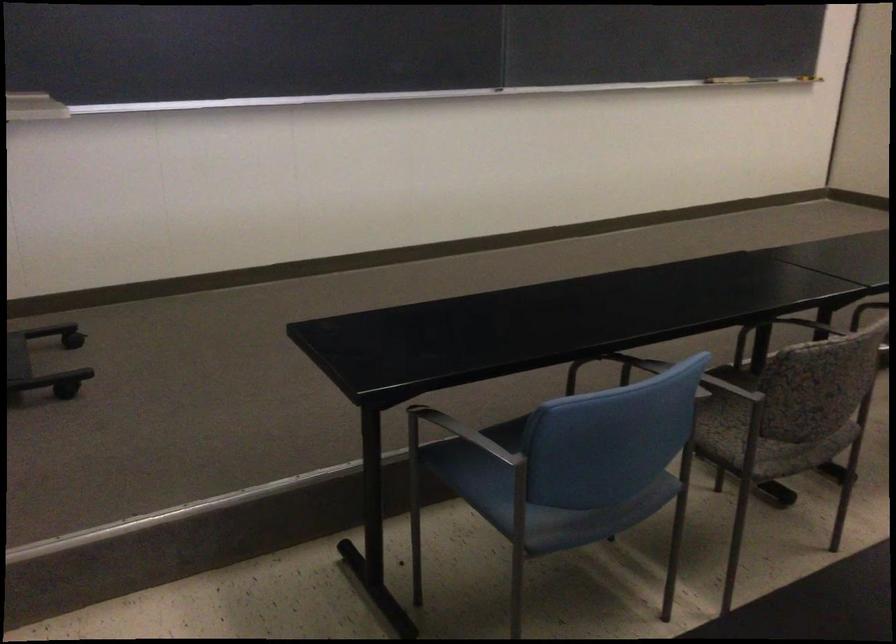
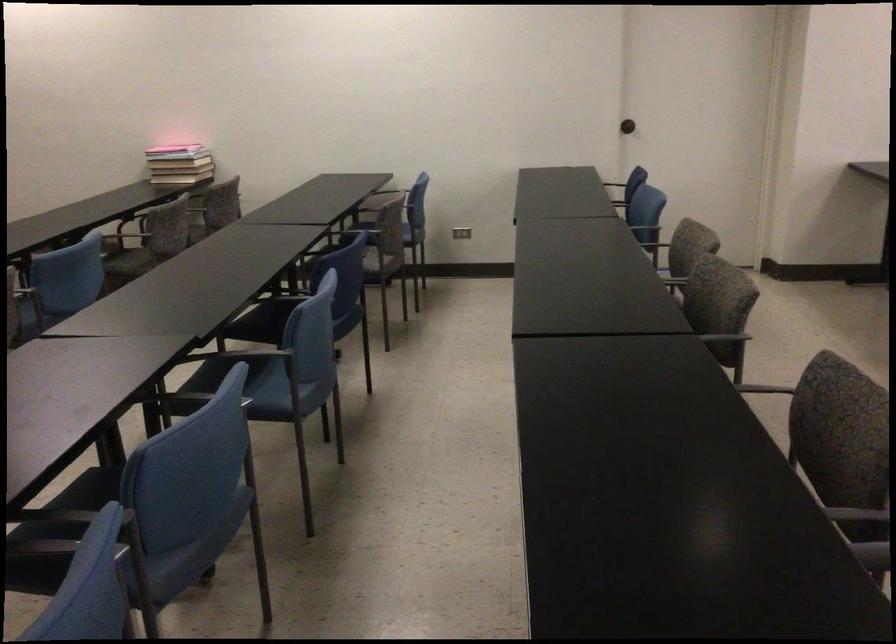
Question: The images are taken continuously from a first-person perspective. In which direction is your viewpoint rotating?

Choices:
 (A) Left
 (B) Right
 (C) Up
 (D) Down

Answer: (B)